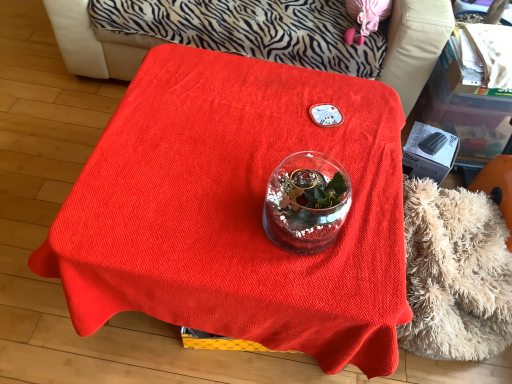
Question: Do you think smooth red tablecloth at center is within black plastic box at right, or outside of it?

Choices:
 (A) inside
 (B) outside

Answer: (B)

Question: Looking at their shapes, would you say smooth red tablecloth at center is wider or thinner than black plastic box at right?

Choices:
 (A) thin
 (B) wide

Answer: (B)

Question: Which object is the farthest from the transparent glass vase at center?

Choices:
 (A) red fabric covered table at center
 (B) black plastic box at right
 (C) smooth red tablecloth at center
 (D) fluffy beige blanket at lower right

Answer: (C)

Question: Estimate the real-world distances between objects in this image. Which object is farther from the black plastic box at right?

Choices:
 (A) red fabric covered table at center
 (B) smooth red tablecloth at center
 (C) fluffy beige blanket at lower right
 (D) transparent glass vase at center

Answer: (B)